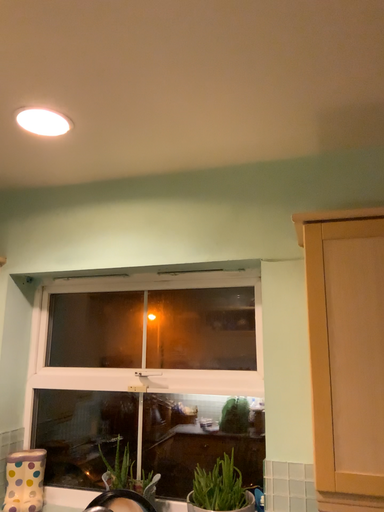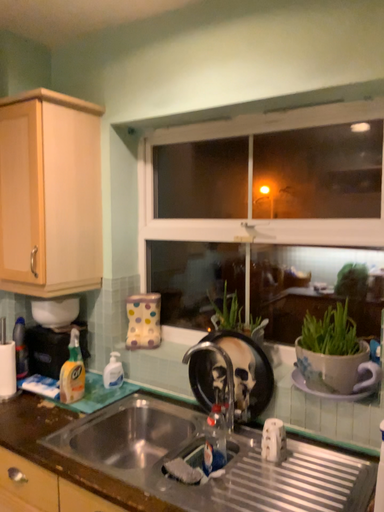
Question: Which way did the camera rotate in the video?

Choices:
 (A) rotated downward
 (B) rotated upward

Answer: (A)